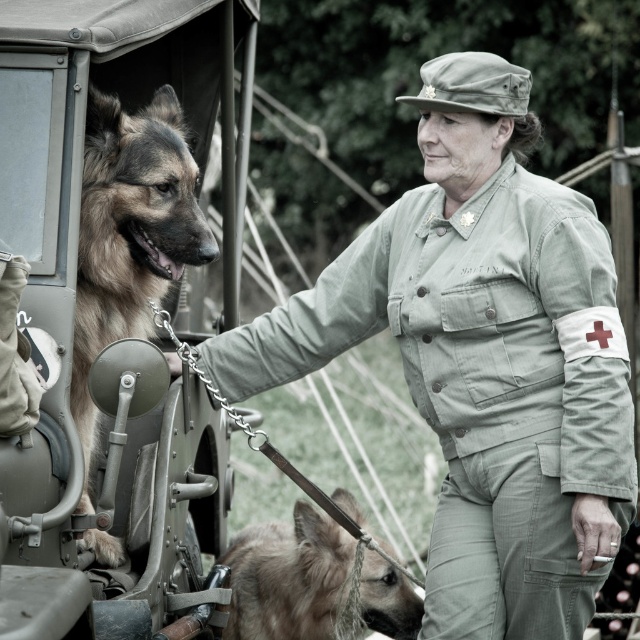
Is matte khaki uniform at center further to camera compared to brown fur dog at left?

Yes.

Is point (460, 502) positioned after point (148, 168)?

Yes, it is.

Identify the location of matte khaki uniform at center. The height and width of the screenshot is (640, 640). (481, 385).

Locate an element on the screen. This screenshot has height=640, width=640. matte khaki uniform at center is located at coordinates (481, 385).

At what (x,y) coordinates should I click in order to perform the action: click on matte green vehicle at left. Please return your answer as a coordinate pair (x, y). The height and width of the screenshot is (640, 640). Looking at the image, I should click on (77, 312).

Is matte green vehicle at left closer to the viewer compared to brown fur dog at left?

Yes, it is in front of brown fur dog at left.

Locate an element on the screen. This screenshot has width=640, height=640. matte green vehicle at left is located at coordinates (77, 312).

Is matte khaki uniform at center taller than matte green vehicle at left?

Yes, matte khaki uniform at center is taller than matte green vehicle at left.

Is point (448, 419) behind point (164, 515)?

Yes, it is behind point (164, 515).

Find the location of a particular element. This screenshot has height=640, width=640. matte khaki uniform at center is located at coordinates [481, 385].